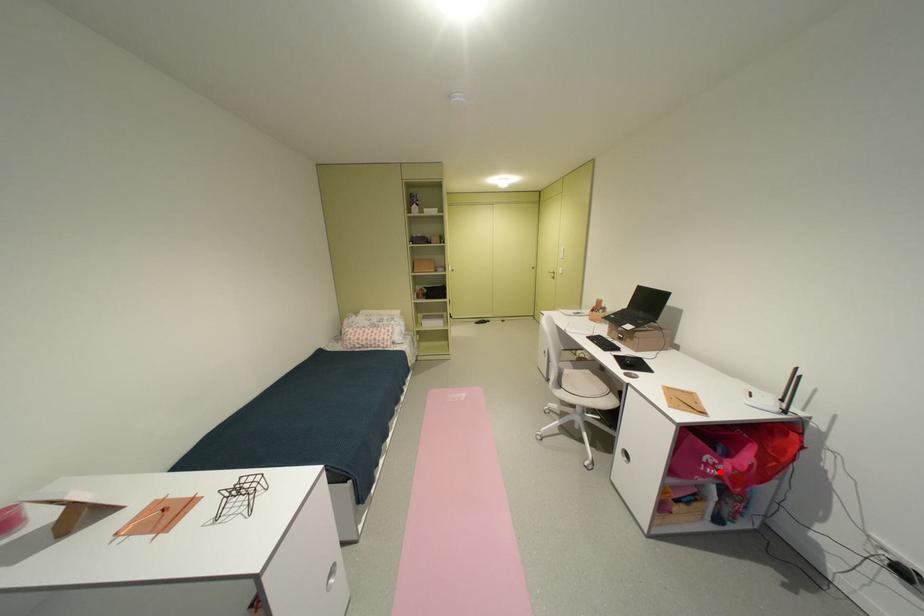
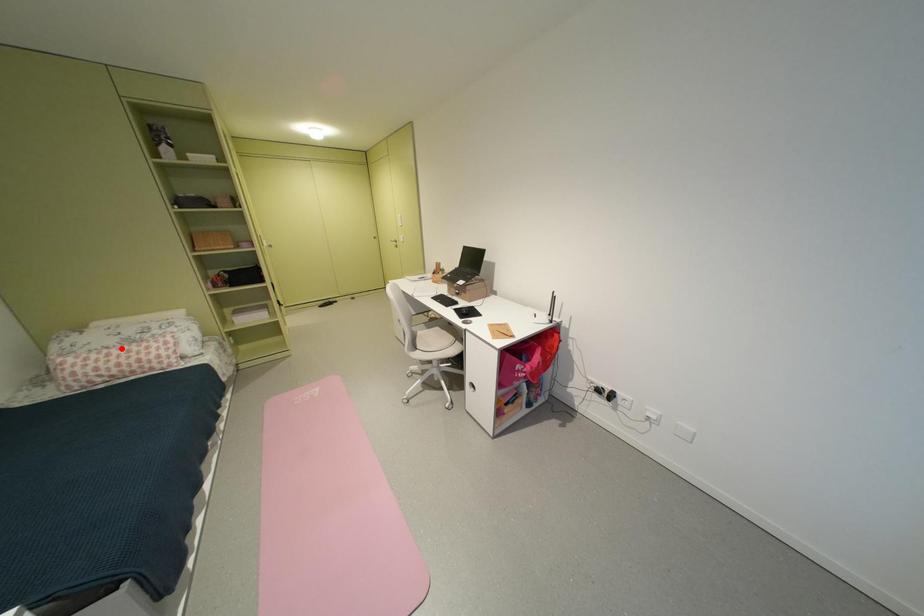
I am providing you with two images of the same scene from different viewpoints. A red point is marked on the first image and another point is marked on the second image. Is the marked point in image1 the same physical position as the marked point in image2?

No